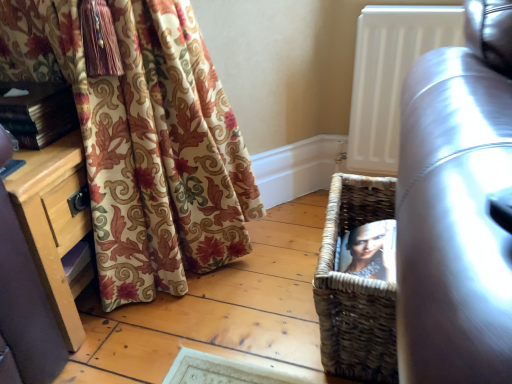
Question: From the image's perspective, is leather couch at right positioned above or below wooden dresser at lower left?

Choices:
 (A) below
 (B) above

Answer: (A)

Question: From a real-world perspective, is leather couch at right above or below wooden dresser at lower left?

Choices:
 (A) below
 (B) above

Answer: (B)

Question: Estimate the real-world distances between objects in this image. Which object is closer to the leather couch at right?

Choices:
 (A) white matte radiator at upper right
 (B) wooden dresser at lower left
 (C) woven brown basket at lower right
 (D) hardcover book at left

Answer: (C)

Question: Estimate the real-world distances between objects in this image. Which object is farther from the hardcover book at left?

Choices:
 (A) wooden dresser at lower left
 (B) white matte radiator at upper right
 (C) leather couch at right
 (D) woven brown basket at lower right

Answer: (B)